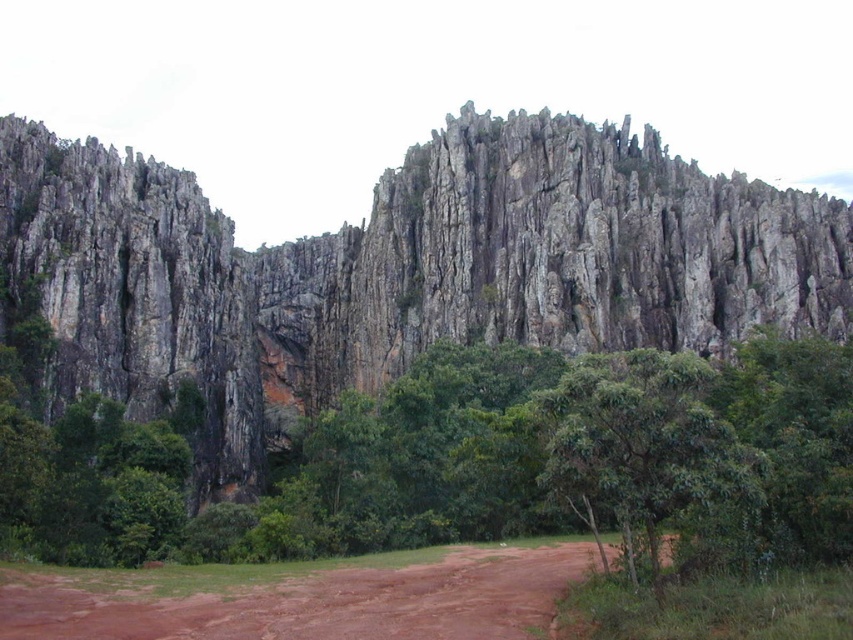
Question: Which object is closer to the camera taking this photo?

Choices:
 (A) green leafy tree at center
 (B) rugged stone mountain at center
 (C) green leafy tree at lower right

Answer: (C)

Question: Which of the following is the farthest from the observer?

Choices:
 (A) green leafy tree at center
 (B) rugged stone mountain at center

Answer: (B)

Question: Is rugged stone mountain at center to the right of green leafy tree at lower right from the viewer's perspective?

Choices:
 (A) no
 (B) yes

Answer: (A)

Question: Does rugged stone mountain at center appear under green leafy tree at lower right?

Choices:
 (A) yes
 (B) no

Answer: (B)

Question: Which point is farther from the camera taking this photo?

Choices:
 (A) (436, 584)
 (B) (451, 164)

Answer: (B)

Question: Can you confirm if rugged stone mountain at center is wider than brown dirt field at lower center?

Choices:
 (A) yes
 (B) no

Answer: (A)